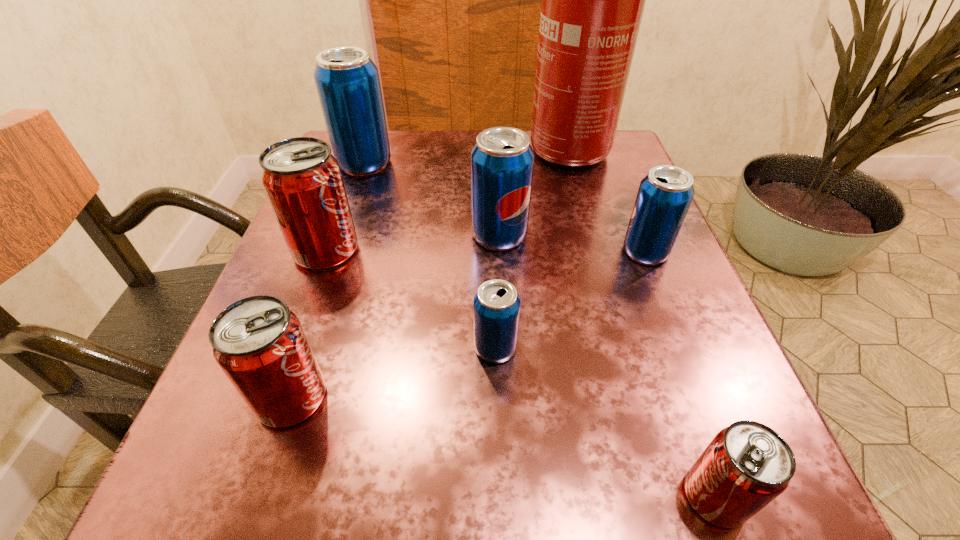
Where is `free location located 0.400m on the back of the seventh farthest object`? free location located 0.400m on the back of the seventh farthest object is located at coordinates (357, 201).

Where is `vacant space located on the back of the smallest blue pop soda`? vacant space located on the back of the smallest blue pop soda is located at coordinates (491, 199).

Identify the location of vacant space situated on the back of the nearest pop soda. The height and width of the screenshot is (540, 960). (666, 359).

Locate an element on the screen. The height and width of the screenshot is (540, 960). fire extinguisher that is at the far edge is located at coordinates tap(593, 0).

In order to click on pop soda positioned at the far edge in this screenshot , I will do `click(347, 81)`.

Locate an element on the screen. This screenshot has width=960, height=540. object that is at the near edge is located at coordinates (747, 465).

The height and width of the screenshot is (540, 960). In order to click on fire extinguisher that is at the right edge in this screenshot , I will do `click(593, 0)`.

This screenshot has height=540, width=960. What are the coordinates of `object that is at the far left corner` in the screenshot? It's located at (347, 81).

At what (x,y) coordinates should I click in order to perform the action: click on object that is at the far right corner. Please return your answer as a coordinate pair (x, y). The width and height of the screenshot is (960, 540). Looking at the image, I should click on (593, 0).

The image size is (960, 540). Find the location of `object that is at the near right corner`. object that is at the near right corner is located at coordinates (747, 465).